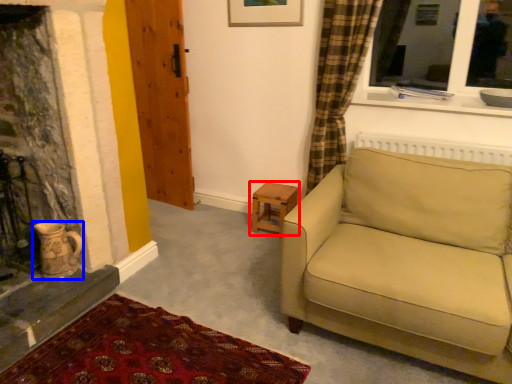
Question: Among these objects, which one is farthest to the camera, table (highlighted by a red box) or tea pot (highlighted by a blue box)?

Choices:
 (A) table
 (B) tea pot

Answer: (A)